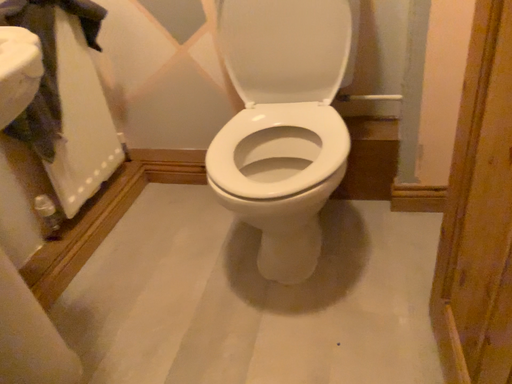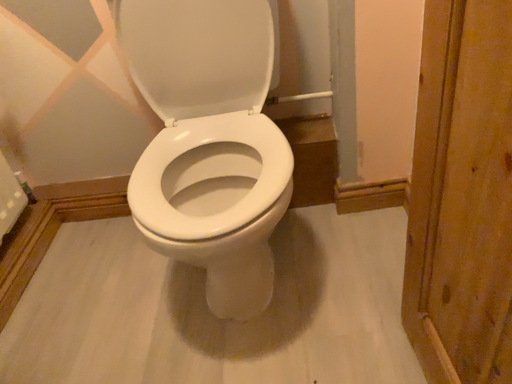
Question: How did the camera likely rotate when shooting the video?

Choices:
 (A) rotated left
 (B) rotated right

Answer: (B)